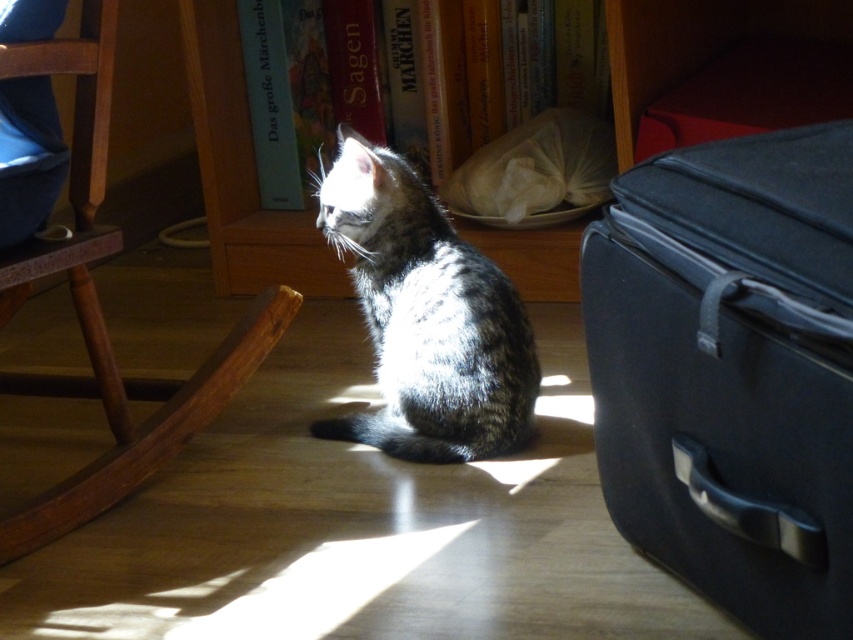
Question: Which of the following is the closest to the observer?

Choices:
 (A) gray tabby cat at center
 (B) wooden bookshelf at upper center

Answer: (A)

Question: Which object is positioned farthest from the matte black suitcase at right?

Choices:
 (A) wooden bookshelf at upper center
 (B) gray tabby cat at center

Answer: (A)

Question: Does matte black suitcase at right have a smaller size compared to gray tabby cat at center?

Choices:
 (A) yes
 (B) no

Answer: (A)

Question: Is wooden bookshelf at upper center to the left of wooden rocking chair at left from the viewer's perspective?

Choices:
 (A) yes
 (B) no

Answer: (B)

Question: Which of the following is the closest to the observer?

Choices:
 (A) (381, 332)
 (B) (511, 234)

Answer: (A)

Question: Does matte black suitcase at right have a smaller size compared to gray tabby cat at center?

Choices:
 (A) no
 (B) yes

Answer: (B)